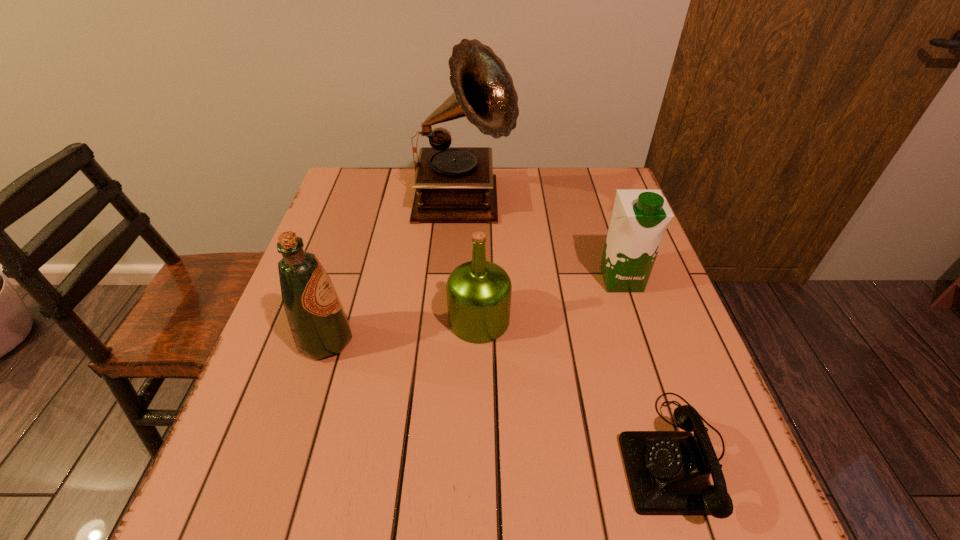
Identify the location of the farthest object. Image resolution: width=960 pixels, height=540 pixels. (453, 184).

What are the coordinates of `the tallest object` in the screenshot? It's located at (453, 184).

At what (x,y) coordinates should I click in order to perform the action: click on the left olive oil. Please return your answer as a coordinate pair (x, y). Image resolution: width=960 pixels, height=540 pixels. Looking at the image, I should click on (319, 325).

Locate an element on the screen. Image resolution: width=960 pixels, height=540 pixels. the leftmost object is located at coordinates (319, 325).

Where is `soya milk`? The width and height of the screenshot is (960, 540). soya milk is located at coordinates (640, 218).

Identify the location of the shorter olive oil. (478, 292).

Locate an element on the screen. The height and width of the screenshot is (540, 960). telephone is located at coordinates (668, 472).

Where is `the nearest object`? the nearest object is located at coordinates (668, 472).

You are a GUI agent. You are given a task and a screenshot of the screen. Output one action in this format:
    pyautogui.click(x=<x>, y=<y>)
    Task: Click on the vacant space positioned on the horn of the record player
    This screenshot has width=960, height=540.
    Given the screenshot: What is the action you would take?
    pyautogui.click(x=604, y=205)

The width and height of the screenshot is (960, 540). In order to click on vacant space located 0.220m on the front-facing side of the left olive oil in this screenshot , I will do `click(456, 341)`.